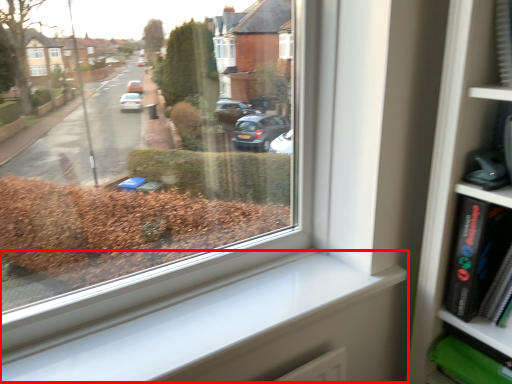
Question: From the image, what is the correct spatial relationship of window sill (annotated by the red box) in relation to paperback book?

Choices:
 (A) right
 (B) left

Answer: (B)